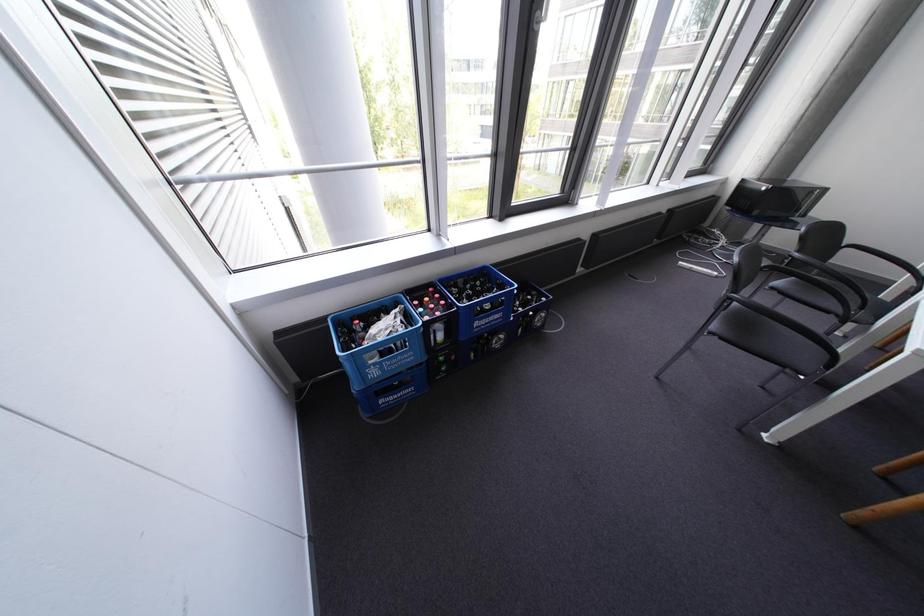
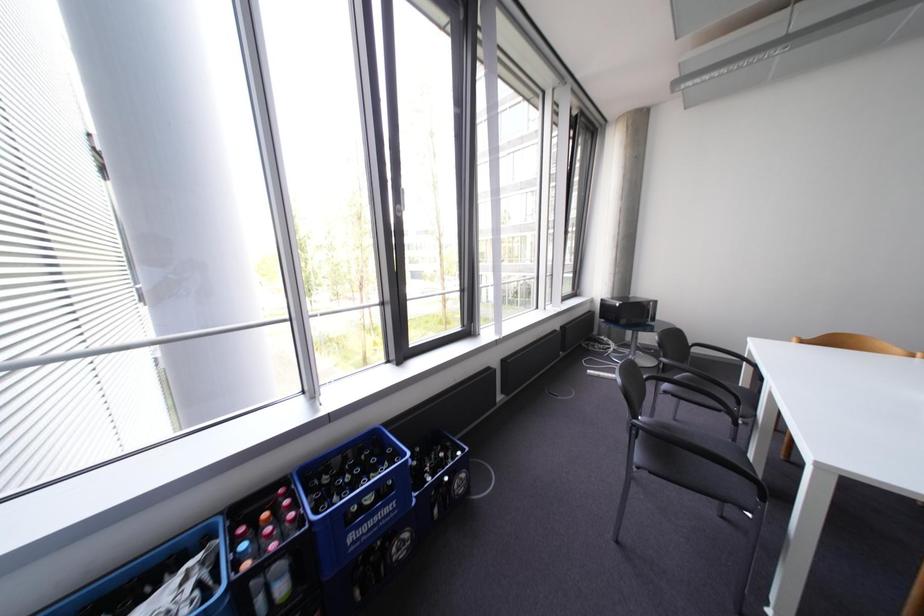
The first image is from the beginning of the video and the second image is from the end. How did the camera likely rotate when shooting the video?

The camera rotated toward right-up.